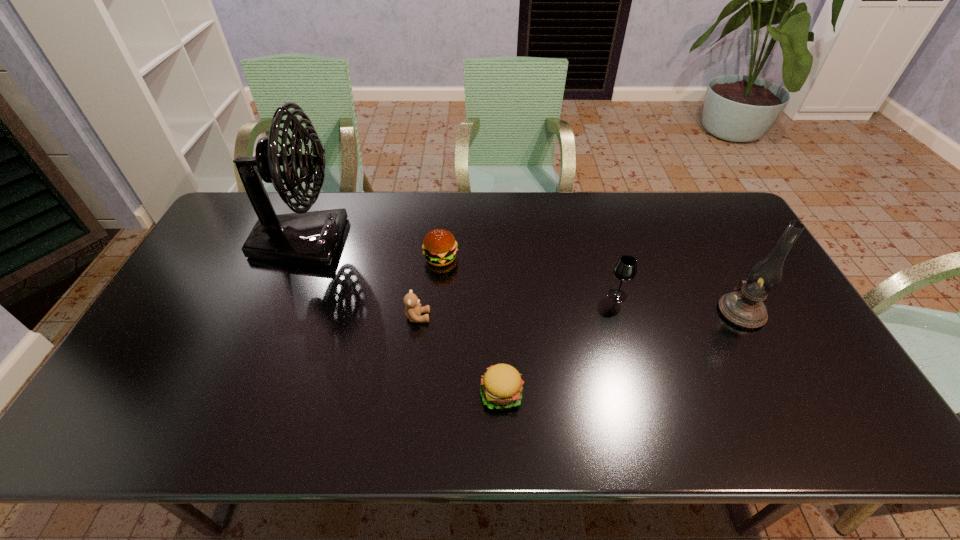
Find the location of a particular element. fan is located at coordinates (312, 238).

The width and height of the screenshot is (960, 540). I want to click on the leftmost object, so click(x=312, y=238).

You are a GUI agent. You are given a task and a screenshot of the screen. Output one action in this format:
    pyautogui.click(x=<x>, y=<y>)
    Task: Click on the oil lamp
    This screenshot has width=960, height=540.
    Given the screenshot: What is the action you would take?
    pos(743,307)

I want to click on the second tallest object, so click(x=743, y=307).

Where is `the fourth shortest object`? This screenshot has width=960, height=540. the fourth shortest object is located at coordinates (625, 269).

Find the location of a particular element. The image size is (960, 540). wineglass is located at coordinates (625, 269).

Image resolution: width=960 pixels, height=540 pixels. Identify the location of the farther hamburger. click(x=440, y=247).

Identify the location of the taller hamburger. (440, 247).

At what (x,y) coordinates should I click in order to perform the action: click on teddy bear. Please return your answer as a coordinate pair (x, y). Looking at the image, I should click on pos(413,309).

Find the location of `the nearest object`. the nearest object is located at coordinates (501, 386).